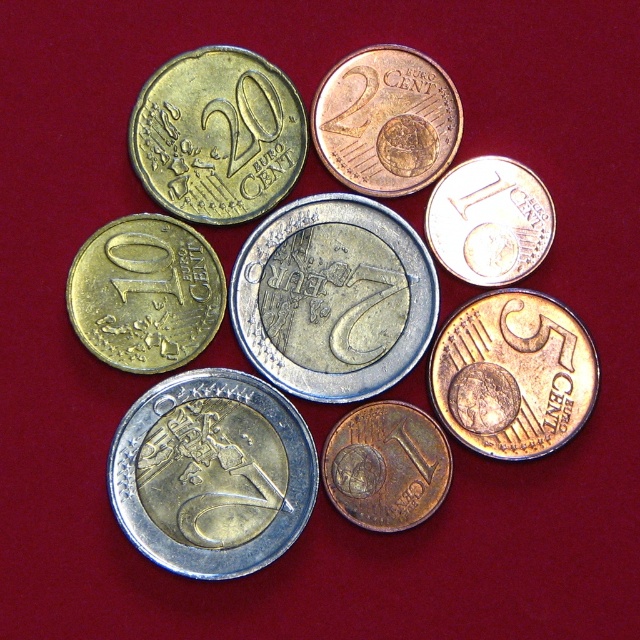
Question: Is silver metallic euro coin at center below brass metallic coin at center?

Choices:
 (A) yes
 (B) no

Answer: (B)

Question: Which object is the closest to the brass metallic coin at center?

Choices:
 (A) gold plated coin at upper center
 (B) gold-plated coin at left
 (C) gold-plated copper 5 cent coin at center-right
 (D) shiny copper coin at upper right

Answer: (C)

Question: Can you confirm if silver metallic euro coin at center is wider than shiny copper coin at upper right?

Choices:
 (A) yes
 (B) no

Answer: (A)

Question: Among these objects, which one is nearest to the camera?

Choices:
 (A) gold-plated coin at left
 (B) gold-plated copper 5 cent coin at center-right
 (C) shiny copper coin at upper right

Answer: (A)

Question: Is gold plated coin at upper center to the right of brass metallic coin at center from the viewer's perspective?

Choices:
 (A) yes
 (B) no

Answer: (A)

Question: Which is nearer to the silver metallic euro coin at center?

Choices:
 (A) silver/golden metallic coin at center
 (B) gold-plated coin at left
 (C) brass metallic coin at center

Answer: (C)